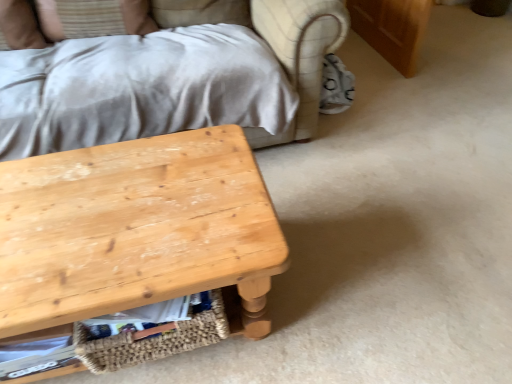
Question: Can you confirm if woven straw basket at lower center is bigger than white fabric pillow at upper left?

Choices:
 (A) no
 (B) yes

Answer: (B)

Question: Is woven straw basket at lower center positioned beyond the bounds of white fabric pillow at upper left?

Choices:
 (A) yes
 (B) no

Answer: (A)

Question: Considering the relative sizes of woven straw basket at lower center and white fabric pillow at upper left in the image provided, is woven straw basket at lower center shorter than white fabric pillow at upper left?

Choices:
 (A) no
 (B) yes

Answer: (B)

Question: Does woven straw basket at lower center appear on the right side of white fabric pillow at upper left?

Choices:
 (A) no
 (B) yes

Answer: (B)

Question: Is woven straw basket at lower center to the left of white fabric pillow at upper left from the viewer's perspective?

Choices:
 (A) yes
 (B) no

Answer: (B)

Question: Do you think natural wood table at lower left is within white fabric pillow at upper left, or outside of it?

Choices:
 (A) outside
 (B) inside

Answer: (A)

Question: Based on their positions, is natural wood table at lower left located to the left or right of white fabric pillow at upper left?

Choices:
 (A) right
 (B) left

Answer: (A)

Question: Is point (59, 215) closer or farther from the camera than point (10, 1)?

Choices:
 (A) farther
 (B) closer

Answer: (B)

Question: From a real-world perspective, is natural wood table at lower left physically located above or below white fabric pillow at upper left?

Choices:
 (A) above
 (B) below

Answer: (B)

Question: Considering the relative positions of woven straw basket at lower center and white fabric pillow at upper left in the image provided, is woven straw basket at lower center to the left or to the right of white fabric pillow at upper left?

Choices:
 (A) right
 (B) left

Answer: (A)

Question: Considering the positions of point (224, 326) and point (4, 36), is point (224, 326) closer or farther from the camera than point (4, 36)?

Choices:
 (A) farther
 (B) closer

Answer: (B)

Question: Considering the positions of woven straw basket at lower center and white fabric pillow at upper left in the image, is woven straw basket at lower center taller or shorter than white fabric pillow at upper left?

Choices:
 (A) short
 (B) tall

Answer: (A)

Question: Is woven straw basket at lower center wider or thinner than white fabric pillow at upper left?

Choices:
 (A) wide
 (B) thin

Answer: (B)

Question: Is natural wood table at lower left in front of or behind woven straw basket at lower center in the image?

Choices:
 (A) behind
 (B) front

Answer: (B)

Question: Considering the positions of point coord(230,228) and point coord(224,327), is point coord(230,228) closer or farther from the camera than point coord(224,327)?

Choices:
 (A) farther
 (B) closer

Answer: (B)